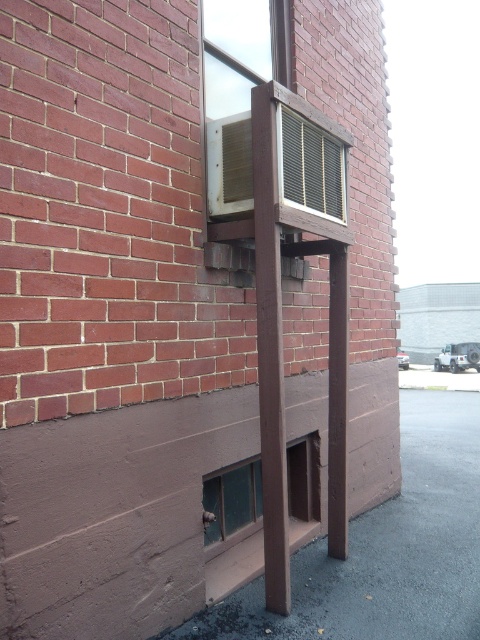
Question: Among these objects, which one is farthest from the camera?

Choices:
 (A) green glass window at lower left
 (B) metallic silver air conditioner at upper center
 (C) transparent glass hole at lower center
 (D) metallic grid window at upper center

Answer: (B)

Question: Is the position of metallic silver air conditioner at upper center more distant than that of green glass window at lower left?

Choices:
 (A) no
 (B) yes

Answer: (B)

Question: Is metallic silver air conditioner at upper center smaller than green glass window at lower left?

Choices:
 (A) yes
 (B) no

Answer: (B)

Question: Which point is farther from the camera taking this photo?

Choices:
 (A) (337, 161)
 (B) (216, 516)
 (C) (210, 211)

Answer: (A)

Question: Does metallic grid window at upper center appear under green glass window at lower left?

Choices:
 (A) yes
 (B) no

Answer: (B)

Question: Which point is farther to the camera?

Choices:
 (A) (226, 196)
 (B) (248, 524)
 (C) (311, 173)
 (D) (229, 541)

Answer: (B)